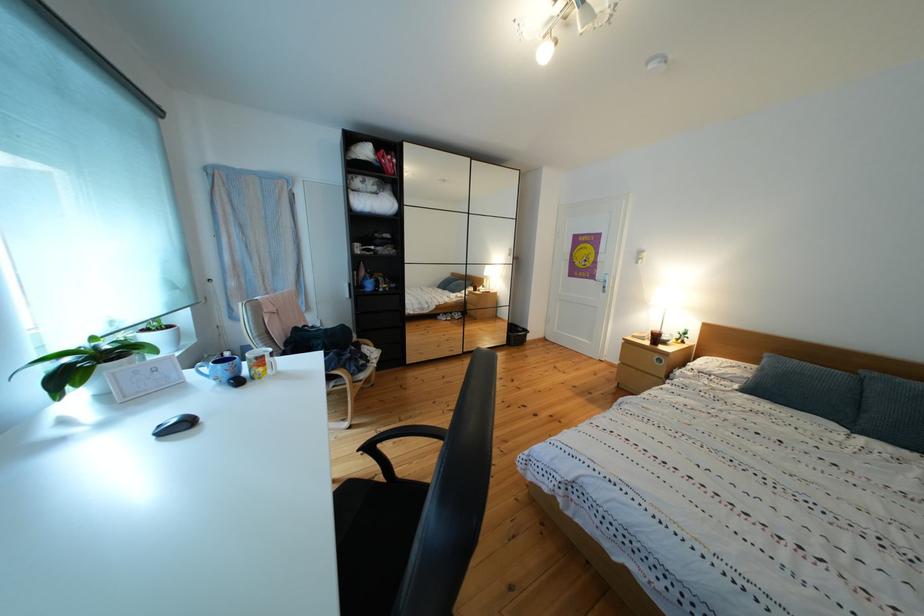
Image resolution: width=924 pixels, height=616 pixels. Identify the location of blue mug handle. (202, 369).